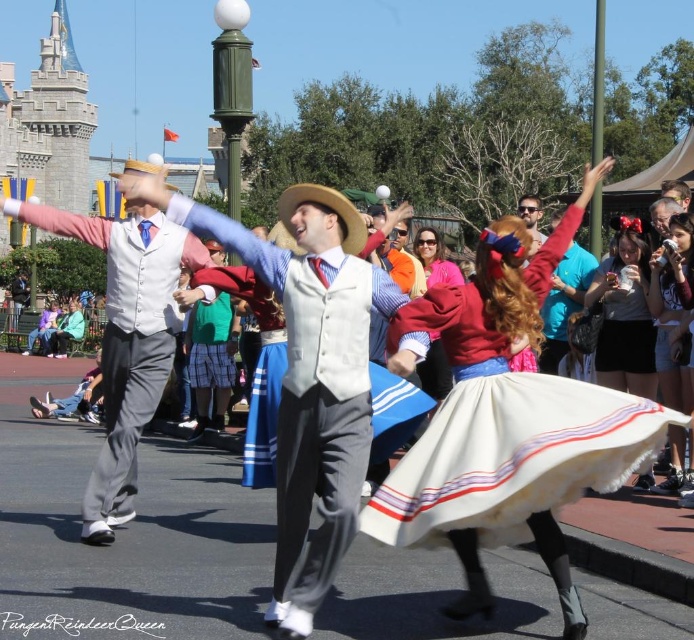
You are a photographer at the theme park and want to capture a photo of the matte black dress at center and the green plaid skirt at center. Which one is located lower in the image?

The matte black dress at center is positioned under the green plaid skirt at center, so it is located lower in the image.

Looking at this image, you are a photographer standing in the crowd at the theme park. You want to take a photo of the matte black dress at center. Where should you position yourself to capture it best?

The matte black dress at center is located at point 0.494 on the x axis and 0.901 on the y axis, so you should position yourself directly in front of that coordinate to capture it best.